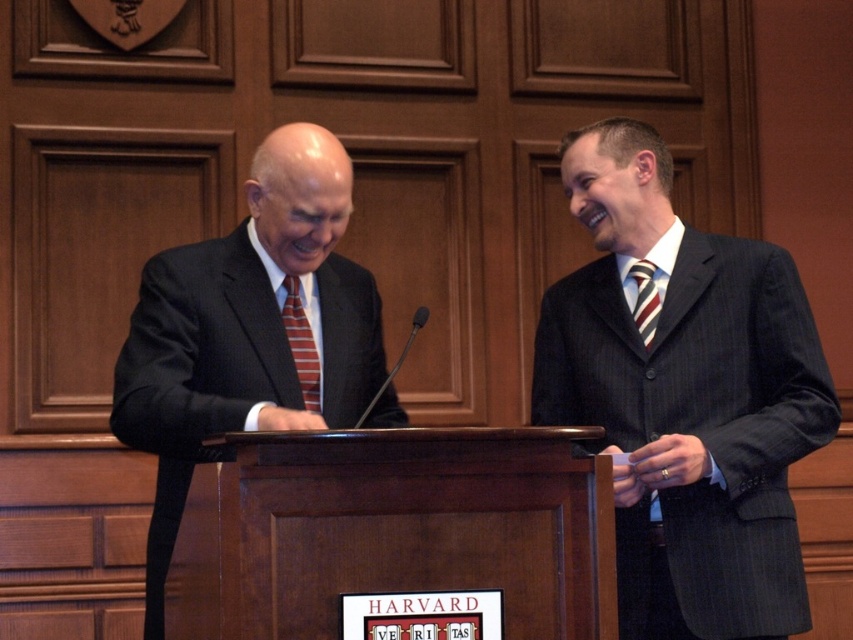
You are an event planner organizing a formal event and need to ensure proper seating arrangements. Given the image of two individuals, one wearing a dark pinstripe suit at right and the other a striped fabric tie at left, which person should be seated in a seat with a higher backrest to match their attire?

The dark pinstripe suit at right has a greater height compared to the striped fabric tie at left, so the person in the dark pinstripe suit at right should be seated in a seat with a higher backrest to match their taller attire.

You are standing at the entrance of the lecture hall and want to approach the wooden podium at center. Which direction should you walk to reach it?

Since the wooden podium at center is located at point 0.823 on the x axis and 0.488 on the y axis, you should walk towards the center of the room to reach it.